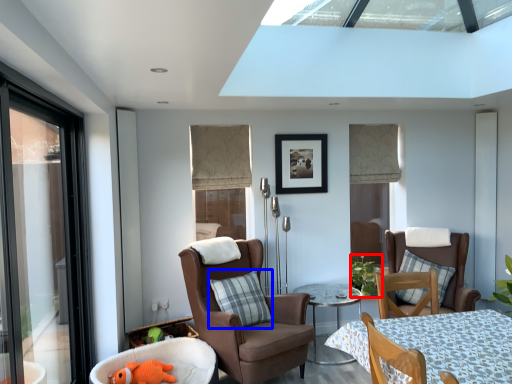
Question: Among these objects, which one is farthest to the camera, plant (highlighted by a red box) or pillow (highlighted by a blue box)?

Choices:
 (A) plant
 (B) pillow

Answer: (A)